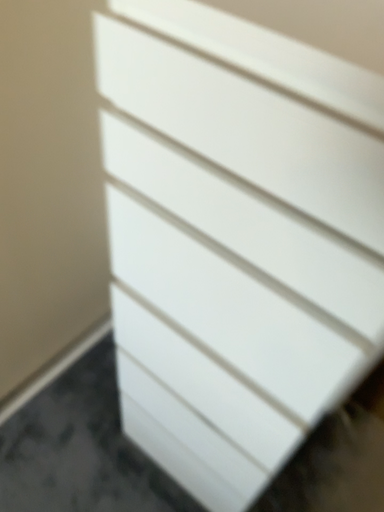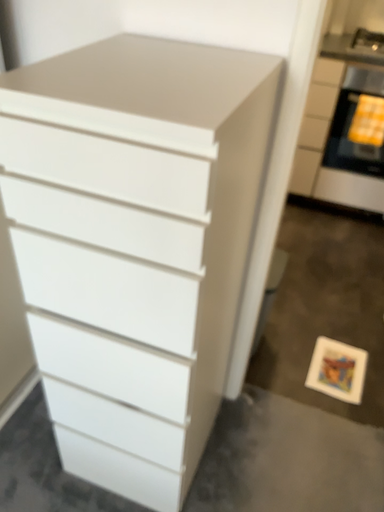
Question: Which way did the camera rotate in the video?

Choices:
 (A) rotated right
 (B) rotated left

Answer: (A)